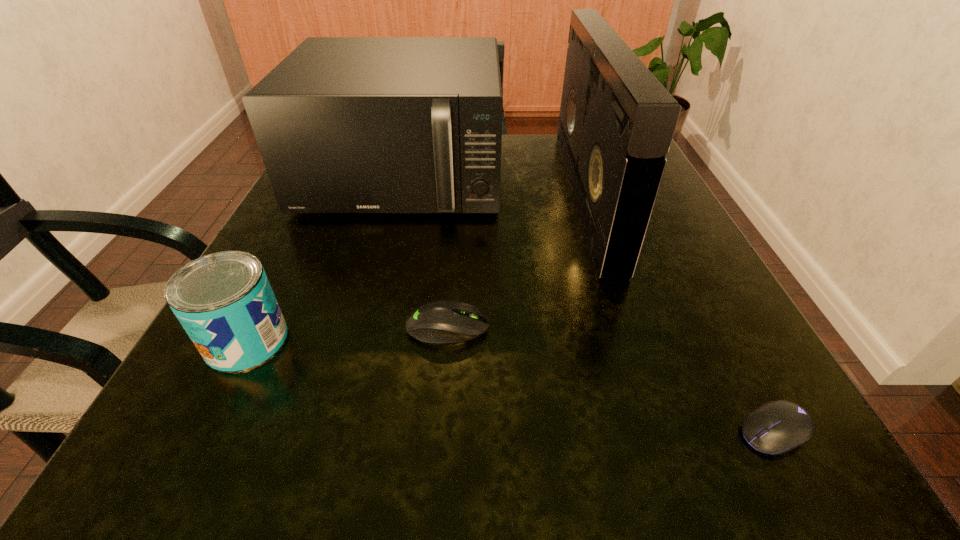
Image resolution: width=960 pixels, height=540 pixels. I want to click on vacant space that satisfies the following two spatial constraints: 1. on the front side of the right computer mouse; 2. on the right side of the second object from right to left, so 664,431.